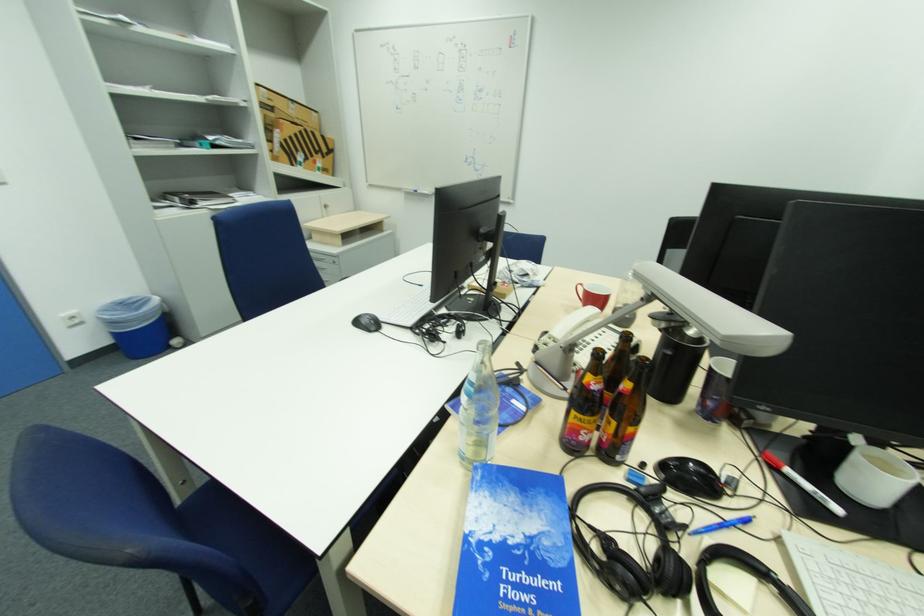
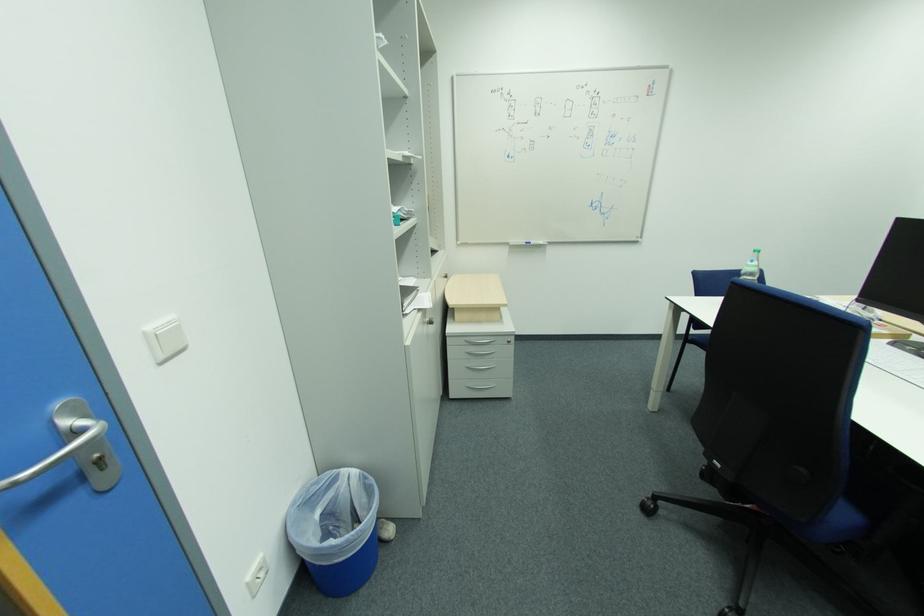
In the second image, find the point that corresponds to pixel 125 305 in the first image.

(304, 507)